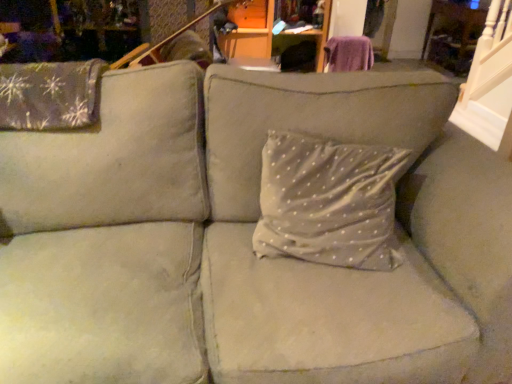
What do you see at coordinates (349, 53) in the screenshot? I see `purple soft towel at upper center` at bounding box center [349, 53].

I want to click on purple soft towel at upper center, so click(349, 53).

At what (x,y) coordinates should I click in order to perform the action: click on purple soft towel at upper center. Please return your answer as a coordinate pair (x, y). Looking at the image, I should click on (349, 53).